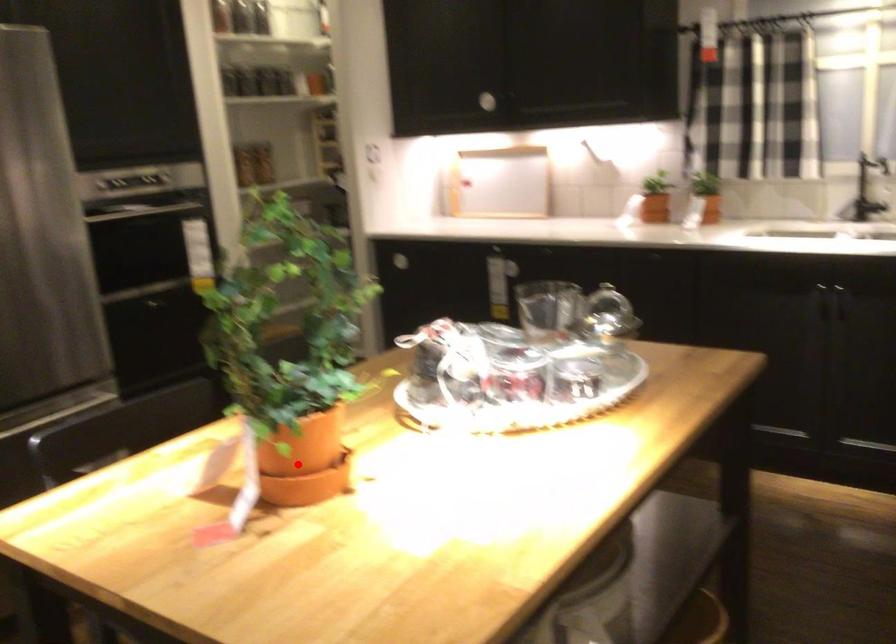
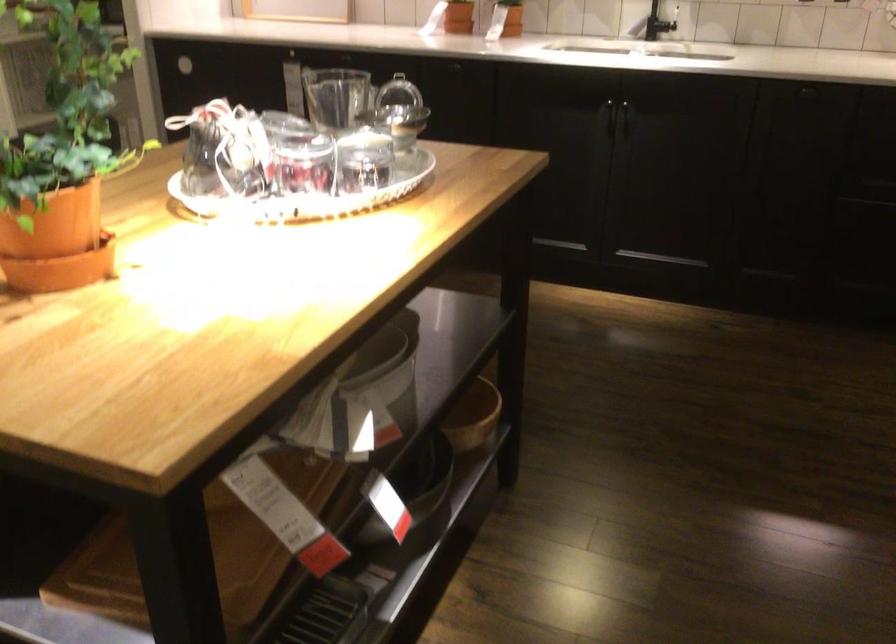
The point at the highlighted location is marked in the first image. Where is the corresponding point in the second image?

(57, 239)